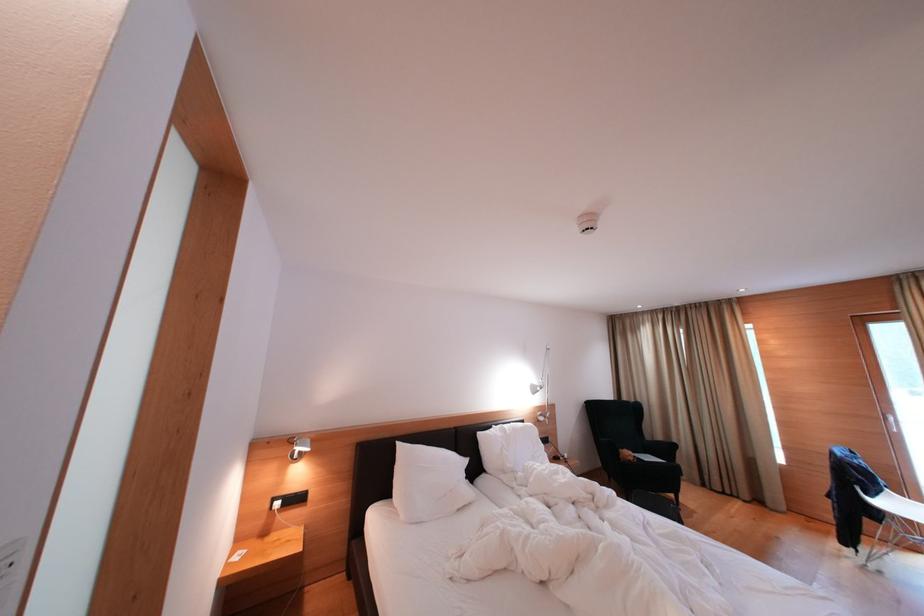
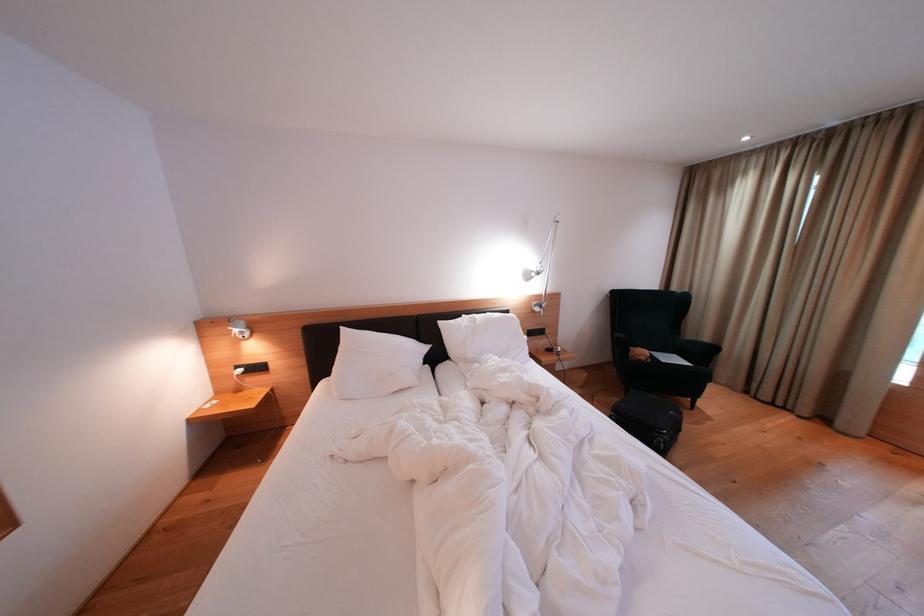
The point at (x=487, y=438) is marked in the first image. Where is the corresponding point in the second image?

(447, 328)